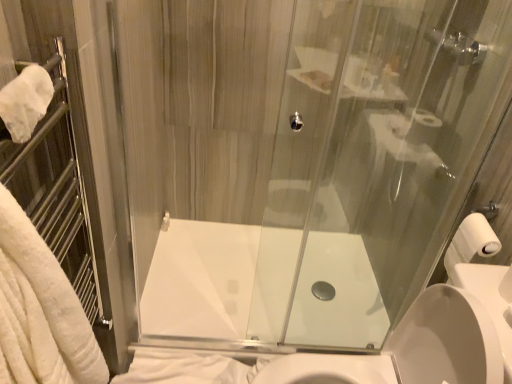
Question: Is white matte toilet paper at right directly adjacent to transparent glass shower door at center?

Choices:
 (A) no
 (B) yes

Answer: (A)

Question: From the image's perspective, is white matte toilet paper at right under transparent glass shower door at center?

Choices:
 (A) yes
 (B) no

Answer: (A)

Question: Can you confirm if white matte toilet paper at right is wider than transparent glass shower door at center?

Choices:
 (A) yes
 (B) no

Answer: (B)

Question: Is white matte toilet paper at right at the left side of transparent glass shower door at center?

Choices:
 (A) no
 (B) yes

Answer: (A)

Question: Can you confirm if white matte toilet paper at right is taller than transparent glass shower door at center?

Choices:
 (A) no
 (B) yes

Answer: (A)

Question: Would you say white glossy sink at center is inside or outside white glossy bath at center?

Choices:
 (A) outside
 (B) inside

Answer: (A)

Question: Is white glossy sink at center wider or thinner than white glossy bath at center?

Choices:
 (A) wide
 (B) thin

Answer: (B)

Question: Is point 440,319 positioned closer to the camera than point 295,233?

Choices:
 (A) closer
 (B) farther

Answer: (A)

Question: From the image's perspective, is white glossy sink at center located above or below white glossy bath at center?

Choices:
 (A) above
 (B) below

Answer: (B)

Question: From a real-world perspective, relative to white matte towel bar at upper left, is white soft towel at left, which appears as the 1th bath towel when viewed from the top, vertically above or below?

Choices:
 (A) above
 (B) below

Answer: (A)

Question: Considering the positions of white soft towel at left, the second bath towel from the back, and white matte towel bar at upper left in the image, is white soft towel at left, the second bath towel from the back, wider or thinner than white matte towel bar at upper left?

Choices:
 (A) thin
 (B) wide

Answer: (B)

Question: Is point (82, 362) positioned closer to the camera than point (168, 218)?

Choices:
 (A) farther
 (B) closer

Answer: (B)

Question: Would you say white soft towel at left, the first bath towel from the front, is to the left or to the right of white matte towel bar at upper left in the picture?

Choices:
 (A) left
 (B) right

Answer: (B)

Question: From a real-world perspective, is white soft towel at lower left, the 2th bath towel viewed from the top, above or below white glossy bath at center?

Choices:
 (A) above
 (B) below

Answer: (A)

Question: Is white soft towel at lower left, positioned as the second bath towel in front-to-back order, wider or thinner than white glossy bath at center?

Choices:
 (A) wide
 (B) thin

Answer: (B)